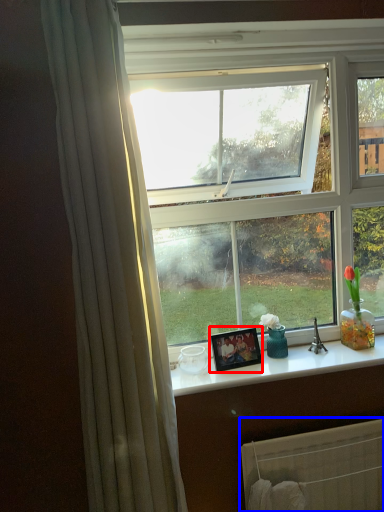
Question: Which object is closer to the camera taking this photo, picture frame (highlighted by a red box) or radiator (highlighted by a blue box)?

Choices:
 (A) picture frame
 (B) radiator

Answer: (B)